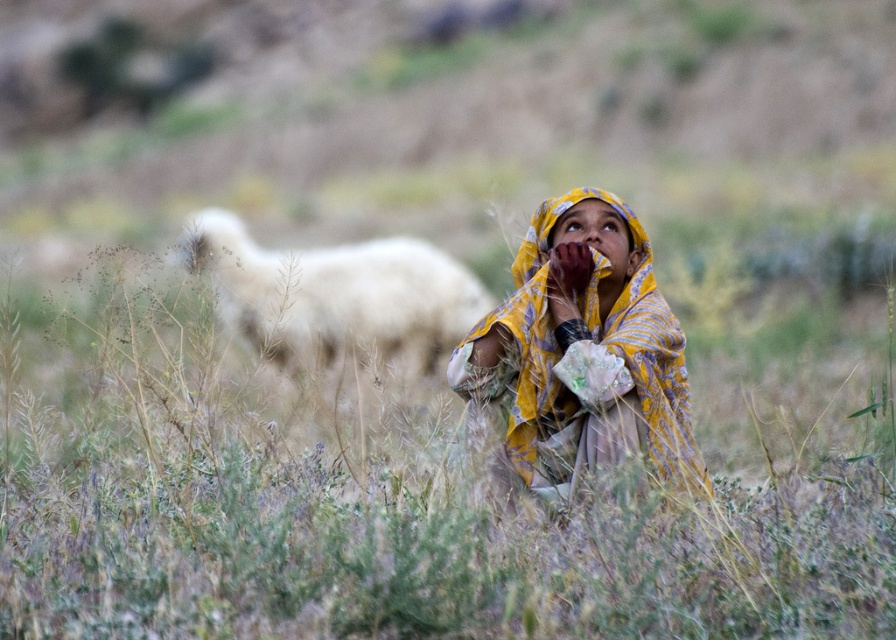
Consider the image. Measure the distance from green grass at center to white woolly sheep at center.

A distance of 1.73 meters exists between green grass at center and white woolly sheep at center.

This screenshot has width=896, height=640. I want to click on green grass at center, so click(415, 492).

In the scene shown: Does green grass at center appear under yellow printed scarf at center?

Yes.

Which is in front, point (71, 452) or point (630, 417)?

Point (630, 417) is more forward.

The width and height of the screenshot is (896, 640). What are the coordinates of `green grass at center` in the screenshot? It's located at (415, 492).

Who is more forward, (610, 404) or (231, 273)?

Point (610, 404) is more forward.

Find the location of `yellow printed scarf at center`. yellow printed scarf at center is located at coordinates (582, 349).